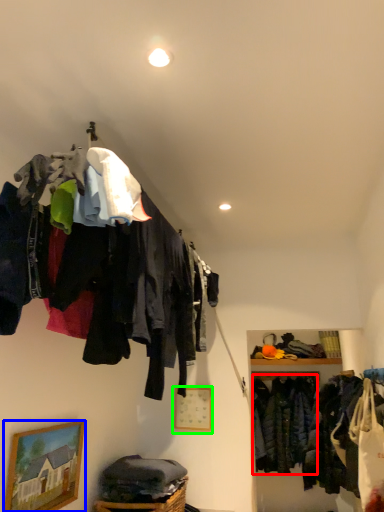
Question: Which object is the farthest from clothing (highlighted by a red box)? Choose among these: picture frame (highlighted by a blue box) or picture frame (highlighted by a green box).

Choices:
 (A) picture frame
 (B) picture frame

Answer: (A)